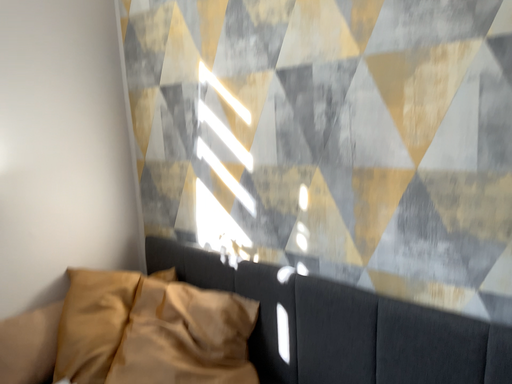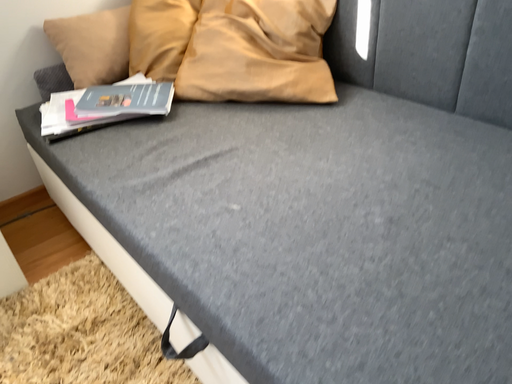
Question: How did the camera likely rotate when shooting the video?

Choices:
 (A) rotated right
 (B) rotated left

Answer: (B)